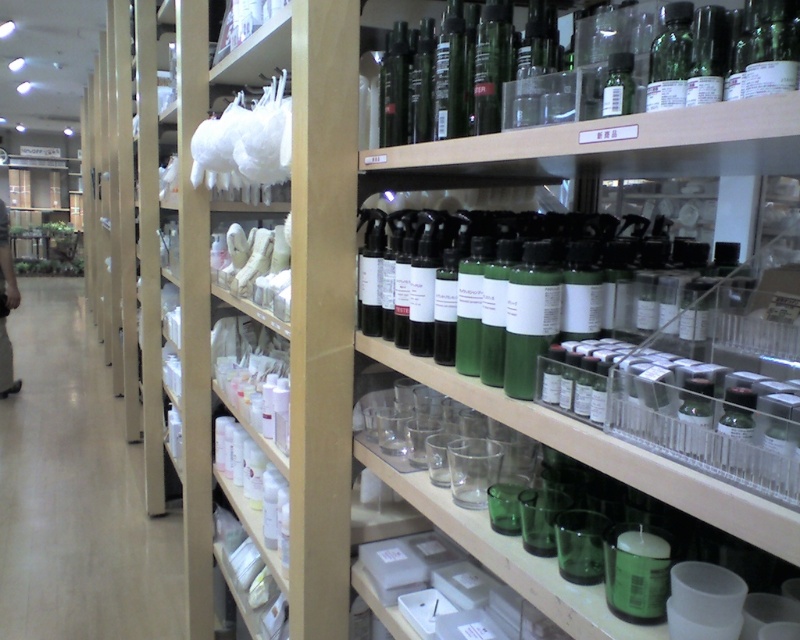
Question: Which object is positioned farthest from the green glass bottle at center?

Choices:
 (A) white fabric at upper left
 (B) white plastic cups at left

Answer: (B)

Question: In this image, where is white fabric at upper left located relative to green glass bottle at upper right?

Choices:
 (A) below
 (B) above

Answer: (A)

Question: Does white plastic cups at left appear on the right side of green glass bottle at center?

Choices:
 (A) yes
 (B) no

Answer: (B)

Question: Which point is closer to the camera?

Choices:
 (A) white plastic cups at left
 (B) green glass bottle at center
 (C) green glass bottle at upper center
 (D) white fabric at upper left

Answer: (B)

Question: Can you confirm if white plastic cups at left is positioned below green glass bottle at upper right?

Choices:
 (A) no
 (B) yes

Answer: (B)

Question: Which object is farther from the camera taking this photo?

Choices:
 (A) green glass bottle at upper right
 (B) green glass bottle at upper center
 (C) white fabric at upper left

Answer: (C)